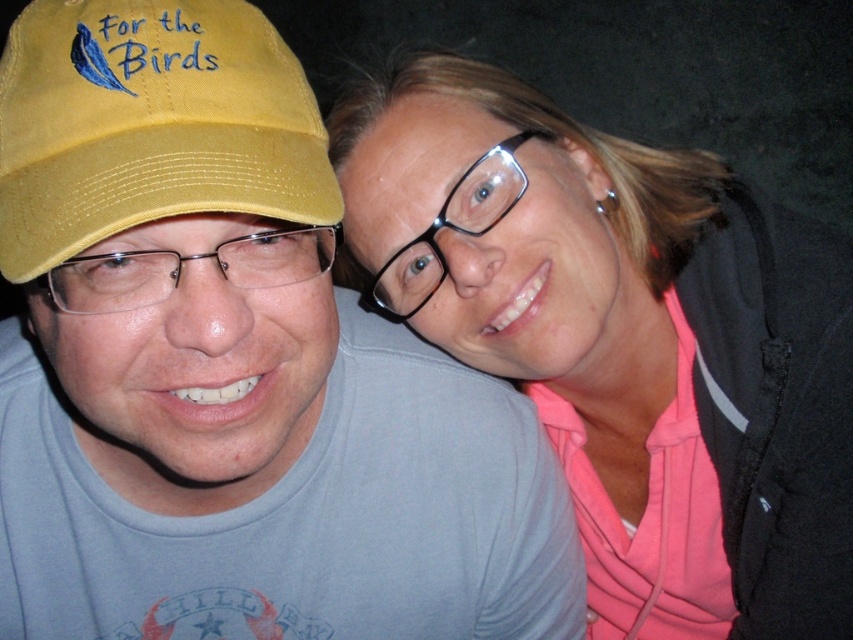
You are a photographer trying to adjust the lighting for a photo shoot. You notice the yellow fabric cap at left and the pink fabric at upper right. Which object is closer to the camera?

The yellow fabric cap at left is behind the pink fabric at upper right, meaning the pink fabric at upper right is closer to the camera.

You are a photographer trying to capture a clear shot of both the matte yellow cap at left and the yellow fabric cap at left. Since both are on the left side, which one is positioned higher up in the frame?

The matte yellow cap at left is taller than the yellow fabric cap at left, so it is positioned higher up in the frame.

You are taking a photo of two people standing close together. The person on the left has a yellow baseball cap with a blue feather graphic, and the person on the right is wearing a pink hoodie under a black jacket. You notice a point at coordinates (231, 369). Based on the scene description, where is this point located?

The point at (231, 369) is on the matte yellow cap at left.